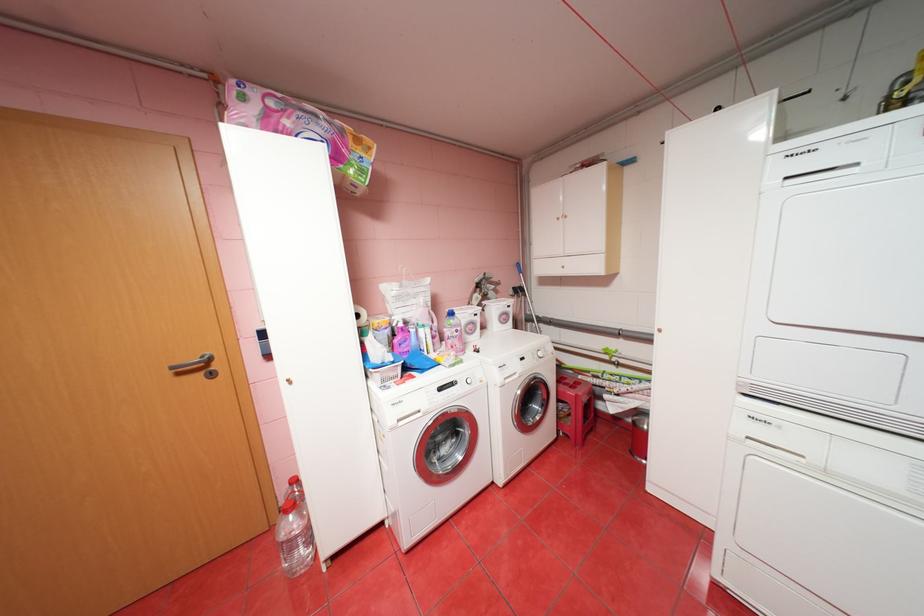
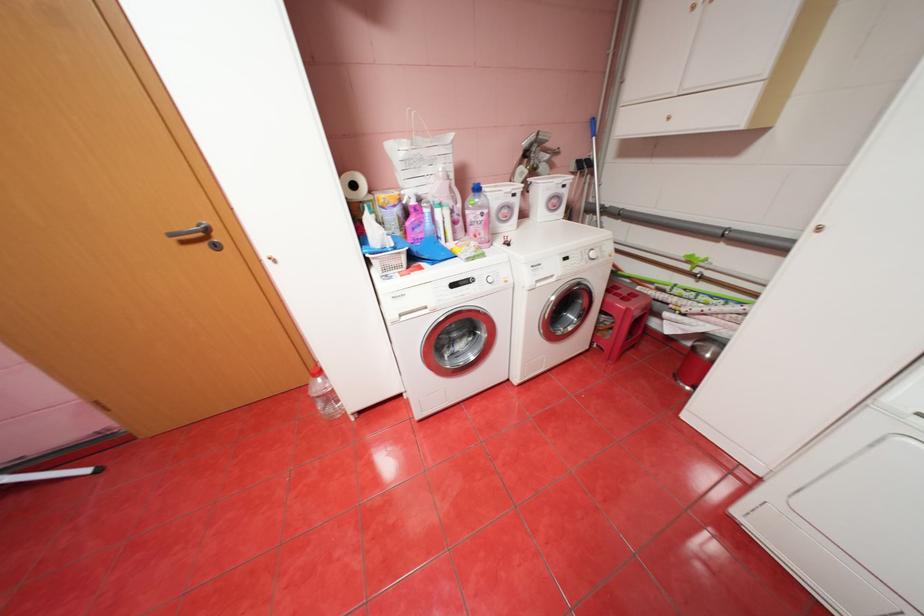
Where in the second image is the point corresponding to point (515, 313) from the first image?

(566, 197)